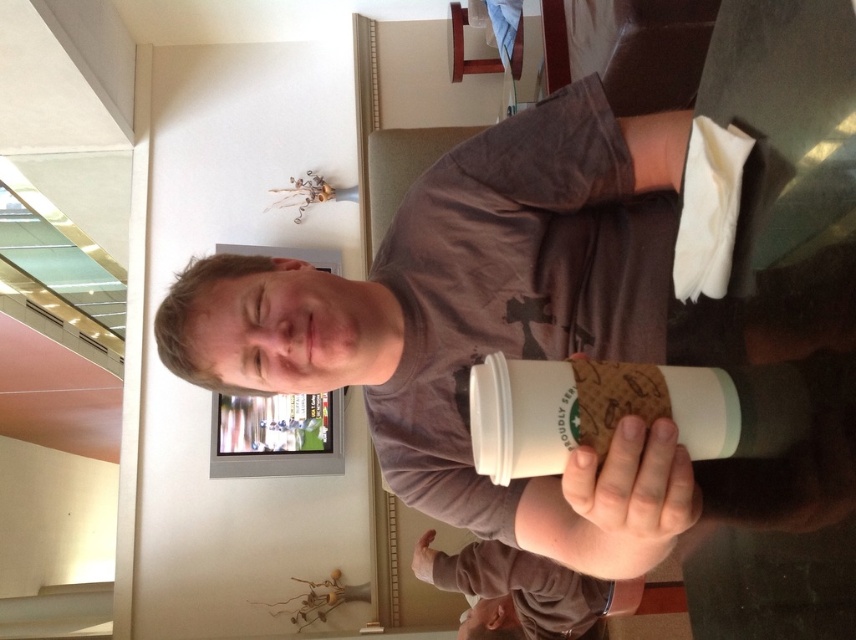
Does white paper cup at center have a greater width compared to brown matte t-shirt at lower center?

No, white paper cup at center is not wider than brown matte t-shirt at lower center.

How far apart are white paper cup at center and brown matte t-shirt at lower center?

5.62 feet

Measure the distance between point [736,134] and camera.

A distance of 25.75 inches exists between point [736,134] and camera.

The width and height of the screenshot is (856, 640). I want to click on white paper cup at center, so click(x=547, y=326).

From the picture: Does white paper cup at center have a lesser height compared to white matte hand at center?

In fact, white paper cup at center may be taller than white matte hand at center.

Is white paper cup at center thinner than white matte hand at center?

In fact, white paper cup at center might be wider than white matte hand at center.

Does point (282, 356) come closer to viewer compared to point (420, 547)?

Yes, point (282, 356) is closer to viewer.

Identify the location of white paper cup at center. This screenshot has width=856, height=640. (547, 326).

Can you confirm if brown matte t-shirt at lower center is positioned above white matte hand at center?

No.

Which of these two, brown matte t-shirt at lower center or white matte hand at center, stands taller?

brown matte t-shirt at lower center

At what (x,y) coordinates should I click in order to perform the action: click on brown matte t-shirt at lower center. Please return your answer as a coordinate pair (x, y). This screenshot has height=640, width=856. Looking at the image, I should click on (527, 588).